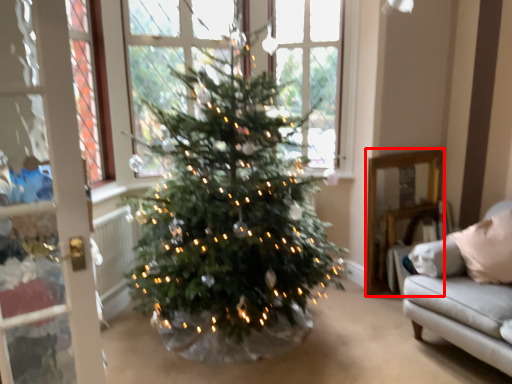
Question: From the image, what is the correct spatial relationship of furniture (annotated by the red box) in relation to window?

Choices:
 (A) left
 (B) right

Answer: (B)